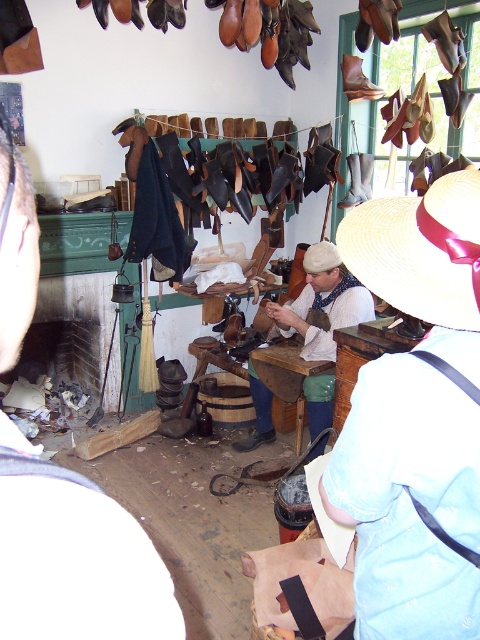
Question: Is leather boot at upper right positioned at the back of matte leather shoe at center?

Choices:
 (A) yes
 (B) no

Answer: (B)

Question: Which object is the closest to the white cotton shirt at center?

Choices:
 (A) brown felt hat at center
 (B) white straw hat at upper center

Answer: (A)

Question: Which of the following is the farthest from the observer?

Choices:
 (A) leather boot at upper right
 (B) brown felt hat at center
 (C) matte leather shoe at center
 (D) white cotton shirt at center

Answer: (C)

Question: Considering the real-world distances, which object is closest to the leather boot at upper right?

Choices:
 (A) white cotton shirt at center
 (B) white straw hat at upper center
 (C) brown leather boot at upper center
 (D) matte leather shoe at center

Answer: (C)

Question: Does brown felt hat at center appear on the left side of matte leather shoe at center?

Choices:
 (A) no
 (B) yes

Answer: (A)

Question: Where is leather boot at upper right located in relation to matte leather shoe at center in the image?

Choices:
 (A) right
 (B) left

Answer: (A)